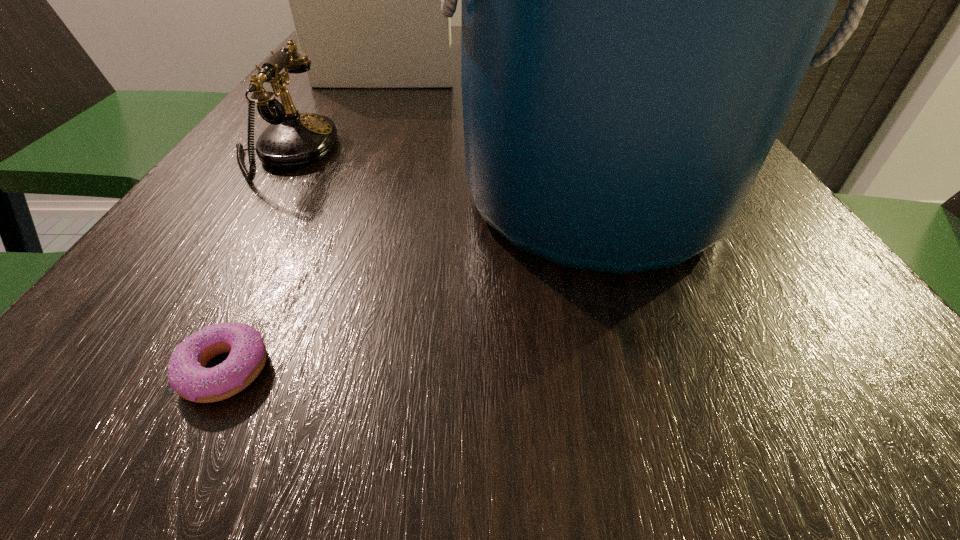
At what (x,y) coordinates should I click in order to perform the action: click on vacant area that satisfies the following two spatial constraints: 1. on the back side of the rightmost object; 2. on the left side of the nearest object. Please return your answer as a coordinate pair (x, y). Image resolution: width=960 pixels, height=540 pixels. Looking at the image, I should click on (310, 197).